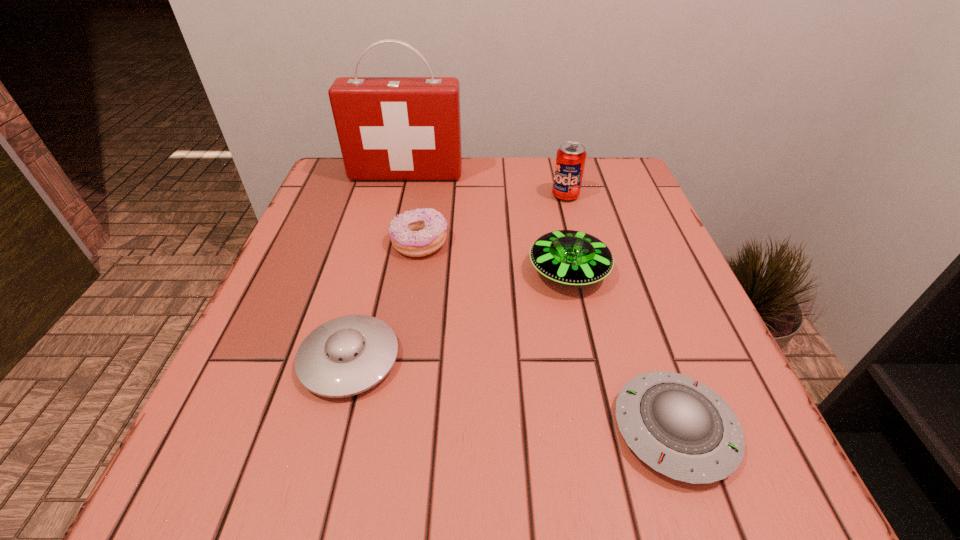
Locate an element on the screen. Image resolution: width=960 pixels, height=540 pixels. the first-aid kit is located at coordinates (389, 128).

Identify the location of the tallest object. (389, 128).

The image size is (960, 540). Identify the location of the fifth shortest object. (570, 160).

Locate an element on the screen. The image size is (960, 540). the fifth nearest object is located at coordinates (570, 160).

The image size is (960, 540). In order to click on the farthest saucer in this screenshot , I will do `click(569, 257)`.

At what (x,y) coordinates should I click in order to perform the action: click on the tallest saucer. Please return your answer as a coordinate pair (x, y). The height and width of the screenshot is (540, 960). Looking at the image, I should click on (569, 257).

Where is `doughnut`? doughnut is located at coordinates (419, 232).

Where is `the leftmost saucer`? the leftmost saucer is located at coordinates (348, 355).

You are a GUI agent. You are given a task and a screenshot of the screen. Output one action in this format:
    pyautogui.click(x=<x>, y=<y>)
    Task: Click on the vacant region located on the front face of the first-aid kit
    This screenshot has width=960, height=540.
    Given the screenshot: What is the action you would take?
    pyautogui.click(x=380, y=284)

The width and height of the screenshot is (960, 540). What are the coordinates of `free region located on the back of the soda can` in the screenshot? It's located at (561, 176).